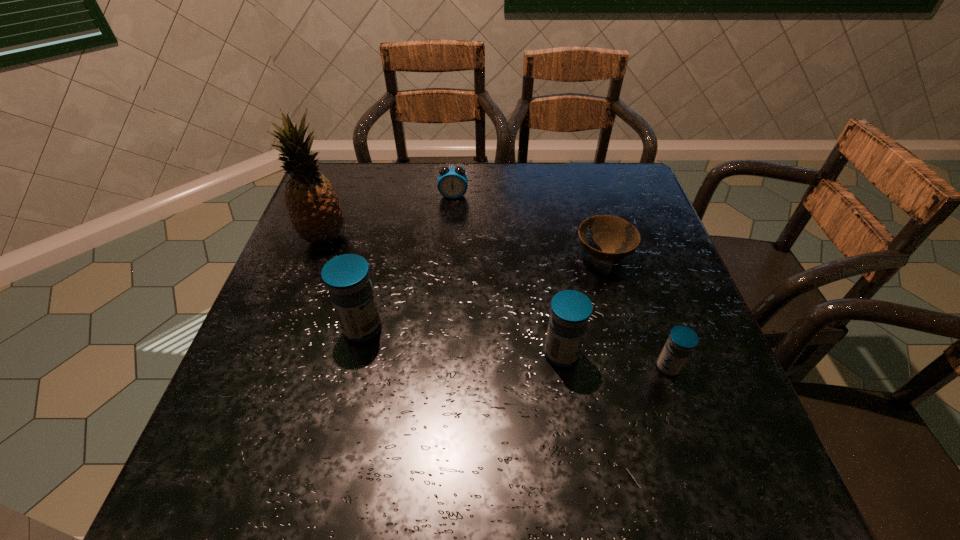
Where is `vacant space at the near edge of the desktop`? The image size is (960, 540). vacant space at the near edge of the desktop is located at coordinates (516, 412).

The height and width of the screenshot is (540, 960). In the image, there is a desktop. Identify the location of free space at the left edge. (286, 287).

In order to click on vacant space at the right edge in this screenshot , I will do `click(719, 367)`.

The width and height of the screenshot is (960, 540). I want to click on blank space at the far right corner of the desktop, so click(590, 195).

You are a GUI agent. You are given a task and a screenshot of the screen. Output one action in this format:
    pyautogui.click(x=<x>, y=<y>)
    Task: Click on the vacant point located between the third object from left to right and the third object from right to left
    This screenshot has width=960, height=540.
    Given the screenshot: What is the action you would take?
    pyautogui.click(x=507, y=274)

The image size is (960, 540). I want to click on vacant area that lies between the tallest object and the third object from left to right, so click(x=389, y=217).

The height and width of the screenshot is (540, 960). In order to click on vacant space in between the alarm clock and the shortest medicine in this screenshot , I will do `click(561, 281)`.

I want to click on vacant area that lies between the rightmost medicine and the third object from left to right, so click(x=561, y=281).

Locate an element on the screen. Image resolution: width=960 pixels, height=540 pixels. free area in between the leftmost medicine and the alarm clock is located at coordinates (408, 262).

Find the location of `unoccupied area between the second object from left to right and the alarm clock`. unoccupied area between the second object from left to right and the alarm clock is located at coordinates (408, 262).